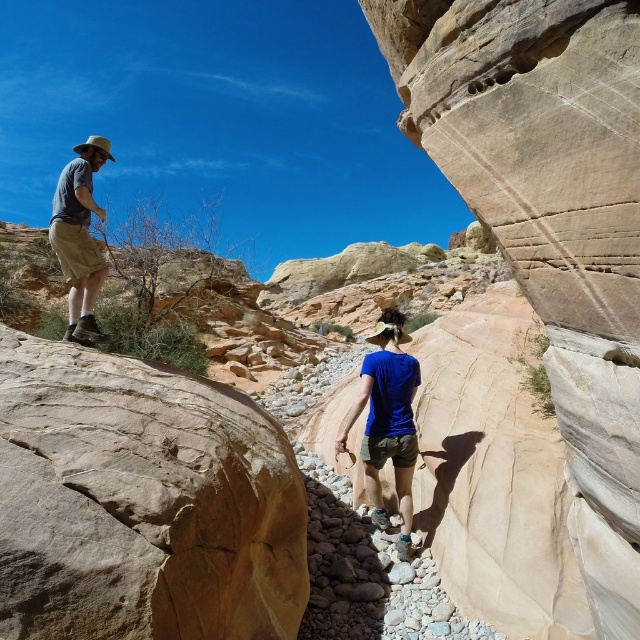
Question: Is blue cotton shirt at center wider than matte gray shirt at left?

Choices:
 (A) no
 (B) yes

Answer: (A)

Question: Which object appears closest to the camera in this image?

Choices:
 (A) matte gray shirt at left
 (B) blue cotton shirt at center

Answer: (A)

Question: Which point appears closest to the camera in this image?

Choices:
 (A) (90, 301)
 (B) (378, 376)
 (C) (88, 561)

Answer: (C)

Question: Can you confirm if smooth beige rock at lower left is positioned to the left of matte gray shirt at left?

Choices:
 (A) no
 (B) yes

Answer: (A)

Question: Does smooth beige rock at lower left appear over matte gray shirt at left?

Choices:
 (A) yes
 (B) no

Answer: (B)

Question: Which of the following is the farthest from the observer?

Choices:
 (A) (72, 385)
 (B) (333, 449)
 (C) (83, 246)

Answer: (B)